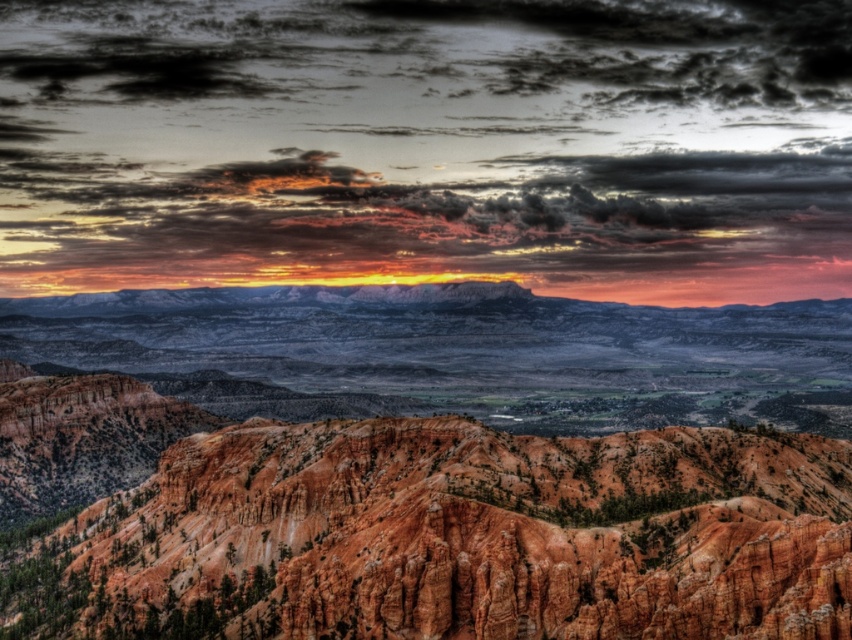
Based on the photo, you are standing at a vantage point in the canyon and see two points marked in the image. The first point is at coordinates point (65, 29) and the second is at point (413, 561). Which point is closer to you?

Point (413, 561) is closer to you because the description states that point (65, 29) is behind point (413, 561).

You are an artist planning to paint the scene. You want to ensure the matte orange sky at upper center and the rustic sandstone mountain at center are proportionally accurate. Which object should you make wider in your painting?

The matte orange sky at upper center should be made wider than the rustic sandstone mountain at center in the painting to maintain proportional accuracy, as its width surpasses that of the mountain according to the description.

You are standing at the bottom of the canyon and looking up at the sky. There is a point marked at coordinates point (429, 145). What color is the area around that point?

The area around point (429, 145) is matte orange sky at upper center.